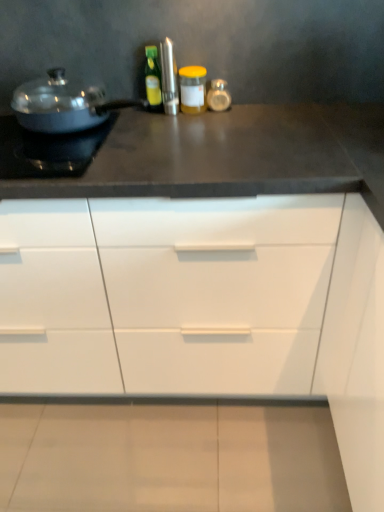
This screenshot has height=512, width=384. What do you see at coordinates (153, 78) in the screenshot?
I see `green glass bottle at center, acting as the 1th bottle starting from the left` at bounding box center [153, 78].

Identify the location of yellow matte jar at center, which ranks as the first bottle in right-to-left order. (193, 89).

Where is `matte black pan at left`? matte black pan at left is located at coordinates (47, 150).

Locate an element on the screen. This screenshot has width=384, height=512. green glass bottle at center, which is the 2th bottle in right-to-left order is located at coordinates (153, 78).

How many degrees apart are the facing directions of green glass bottle at center, which is the 2th bottle in right-to-left order, and white matte cabinet at center?

The angular difference between green glass bottle at center, which is the 2th bottle in right-to-left order, and white matte cabinet at center is 1.09 degrees.

Between green glass bottle at center, acting as the 1th bottle starting from the left, and white matte cabinet at center, which one appears on the right side from the viewer's perspective?

white matte cabinet at center is more to the right.

From the image's perspective, is green glass bottle at center, which is the 2th bottle in right-to-left order, located beneath white matte cabinet at center?

No, from the image's perspective, green glass bottle at center, which is the 2th bottle in right-to-left order, is not below white matte cabinet at center.

Which of these two, green glass bottle at center, acting as the 1th bottle starting from the left, or white matte cabinet at center, stands taller?

white matte cabinet at center.

Visually, is yellow matte jar at center, which ranks as the first bottle in right-to-left order, positioned to the left or to the right of green glass bottle at center, acting as the 1th bottle starting from the left?

In the image, yellow matte jar at center, which ranks as the first bottle in right-to-left order, appears on the right side of green glass bottle at center, acting as the 1th bottle starting from the left.

Which point is more distant from viewer, [202,99] or [156,102]?

The point [156,102] is farther.

Which is in front, yellow matte jar at center, arranged as the 2th bottle when viewed from the left, or green glass bottle at center, which is the 2th bottle in right-to-left order?

yellow matte jar at center, arranged as the 2th bottle when viewed from the left, is closer to the camera.

Between yellow matte jar at center, which ranks as the first bottle in right-to-left order, and green glass bottle at center, acting as the 1th bottle starting from the left, which one has less height?

yellow matte jar at center, which ranks as the first bottle in right-to-left order, is shorter.

Can you tell me how much green glass bottle at center, which is the 2th bottle in right-to-left order, and yellow matte jar at center, which ranks as the first bottle in right-to-left order, differ in facing direction?

green glass bottle at center, which is the 2th bottle in right-to-left order, and yellow matte jar at center, which ranks as the first bottle in right-to-left order, are facing 1.13 degrees away from each other.

The width and height of the screenshot is (384, 512). In the image, there is a yellow matte jar at center, arranged as the 2th bottle when viewed from the left. Find the location of `bottle above it (from the image's perspective)`. bottle above it (from the image's perspective) is located at coordinates (153, 78).

From the image's perspective, which one is positioned higher, green glass bottle at center, acting as the 1th bottle starting from the left, or yellow matte jar at center, which ranks as the first bottle in right-to-left order?

green glass bottle at center, acting as the 1th bottle starting from the left, from the image's perspective.

Is green glass bottle at center, which is the 2th bottle in right-to-left order, outside of yellow matte jar at center, arranged as the 2th bottle when viewed from the left?

Yes, green glass bottle at center, which is the 2th bottle in right-to-left order, is located beyond the bounds of yellow matte jar at center, arranged as the 2th bottle when viewed from the left.

Which of these two, matte black pan at left or white matte cabinet at center, is thinner?

matte black pan at left.

Does point (29, 139) appear closer or farther from the camera than point (212, 367)?

Point (29, 139) appears to be closer to the viewer than point (212, 367).

From a real-world perspective, is matte black pan at left under white matte cabinet at center?

Actually, matte black pan at left is physically above white matte cabinet at center in the real world.

Is matte black pan at left not close to white matte cabinet at center?

Actually, matte black pan at left and white matte cabinet at center are a little close together.

Is shiny metallic pot at left wider than white matte cabinet at center?

In fact, shiny metallic pot at left might be narrower than white matte cabinet at center.

Would you say white matte cabinet at center is part of shiny metallic pot at left's contents?

No, white matte cabinet at center is not inside shiny metallic pot at left.

Considering the relative sizes of shiny metallic pot at left and white matte cabinet at center in the image provided, is shiny metallic pot at left shorter than white matte cabinet at center?

Indeed, shiny metallic pot at left has a lesser height compared to white matte cabinet at center.

In the image, is shiny metallic pot at left positioned in front of or behind white matte cabinet at center?

shiny metallic pot at left is behind white matte cabinet at center.

The height and width of the screenshot is (512, 384). In order to click on cabinetry below the green glass bottle at center, which is the 2th bottle in right-to-left order (from the image's perspective) in this screenshot , I will do `click(204, 306)`.

How many degrees apart are the facing directions of white matte cabinet at center and green glass bottle at center, which is the 2th bottle in right-to-left order?

1.09 degrees.

Does white matte cabinet at center turn towards green glass bottle at center, acting as the 1th bottle starting from the left?

No, white matte cabinet at center is not aimed at green glass bottle at center, acting as the 1th bottle starting from the left.

The height and width of the screenshot is (512, 384). Find the location of `appliance on the left of the shiny metallic pot at left`. appliance on the left of the shiny metallic pot at left is located at coordinates 47,150.

Considering the sizes of objects shiny metallic pot at left and matte black pan at left in the image provided, who is thinner, shiny metallic pot at left or matte black pan at left?

shiny metallic pot at left.

Considering the sizes of objects shiny metallic pot at left and matte black pan at left in the image provided, who is bigger, shiny metallic pot at left or matte black pan at left?

shiny metallic pot at left.

Based on the photo, is shiny metallic pot at left touching matte black pan at left?

No.

Where is `cabinetry below the green glass bottle at center, acting as the 1th bottle starting from the left (from the image's perspective)`? cabinetry below the green glass bottle at center, acting as the 1th bottle starting from the left (from the image's perspective) is located at coordinates (204, 306).

This screenshot has width=384, height=512. Identify the location of bottle in front of the green glass bottle at center, acting as the 1th bottle starting from the left. [193, 89].

In the scene shown: Estimate the real-world distances between objects in this image. Which object is closer to shiny metallic pot at left, green glass bottle at center, which is the 2th bottle in right-to-left order, or white matte cabinet at center?

green glass bottle at center, which is the 2th bottle in right-to-left order, is positioned closer to the anchor shiny metallic pot at left.

Which object lies further to the anchor point white matte cabinet at center, green glass bottle at center, which is the 2th bottle in right-to-left order, or yellow matte jar at center, which ranks as the first bottle in right-to-left order?

green glass bottle at center, which is the 2th bottle in right-to-left order.

Which object lies further to the anchor point green glass bottle at center, acting as the 1th bottle starting from the left, shiny metallic pot at left or white matte cabinet at center?

white matte cabinet at center is further to green glass bottle at center, acting as the 1th bottle starting from the left.

Which object lies nearer to the anchor point shiny metallic pot at left, white matte cabinet at center or green glass bottle at center, which is the 2th bottle in right-to-left order?

green glass bottle at center, which is the 2th bottle in right-to-left order, is closer to shiny metallic pot at left.

Looking at the image, which one is located further to white matte cabinet at center, matte black pan at left or shiny metallic pot at left?

shiny metallic pot at left is positioned further to the anchor white matte cabinet at center.

Which object lies further to the anchor point shiny metallic pot at left, matte black pan at left or white matte cabinet at center?

Among the two, white matte cabinet at center is located further to shiny metallic pot at left.

From the image, which object appears to be farther from green glass bottle at center, which is the 2th bottle in right-to-left order, yellow matte jar at center, which ranks as the first bottle in right-to-left order, or white matte cabinet at center?

Based on the image, white matte cabinet at center appears to be further to green glass bottle at center, which is the 2th bottle in right-to-left order.

Considering their positions, is yellow matte jar at center, which ranks as the first bottle in right-to-left order, positioned further to green glass bottle at center, acting as the 1th bottle starting from the left, than shiny metallic pot at left?

The object further to green glass bottle at center, acting as the 1th bottle starting from the left, is shiny metallic pot at left.

In order to click on kitchen appliance between matte black pan at left and green glass bottle at center, which is the 2th bottle in right-to-left order in this screenshot , I will do `click(63, 104)`.

Where is `bottle between green glass bottle at center, acting as the 1th bottle starting from the left, and white matte cabinet at center from top to bottom`? The image size is (384, 512). bottle between green glass bottle at center, acting as the 1th bottle starting from the left, and white matte cabinet at center from top to bottom is located at coordinates (193, 89).

Locate an element on the screen. The image size is (384, 512). appliance between green glass bottle at center, which is the 2th bottle in right-to-left order, and white matte cabinet at center from top to bottom is located at coordinates (47, 150).

Where is `kitchen appliance that lies between green glass bottle at center, acting as the 1th bottle starting from the left, and white matte cabinet at center from top to bottom`? kitchen appliance that lies between green glass bottle at center, acting as the 1th bottle starting from the left, and white matte cabinet at center from top to bottom is located at coordinates (63, 104).